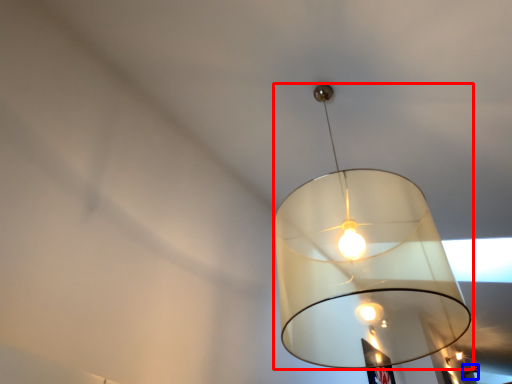
Question: Among these objects, which one is nearest to the camera, lamp (highlighted by a red box) or lamp (highlighted by a blue box)?

Choices:
 (A) lamp
 (B) lamp

Answer: (A)